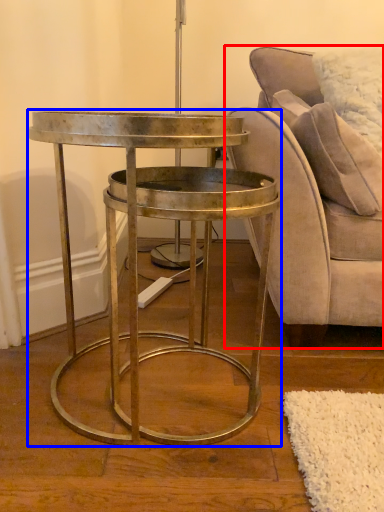
Question: Which of the following is the farthest to the observer, chair (highlighted by a red box) or table (highlighted by a blue box)?

Choices:
 (A) chair
 (B) table

Answer: (A)